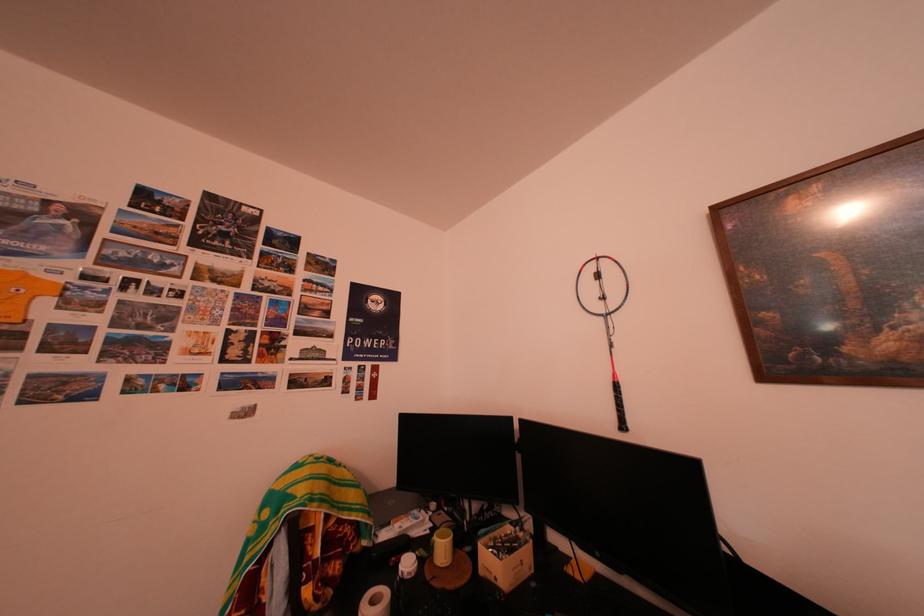
Find the location of `badminton racket handle`. badminton racket handle is located at coordinates (618, 403).